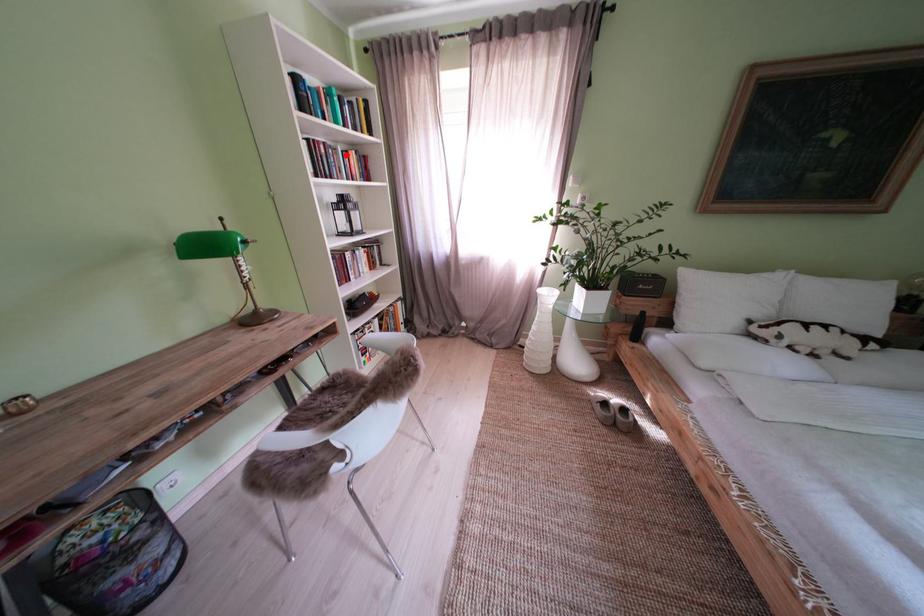
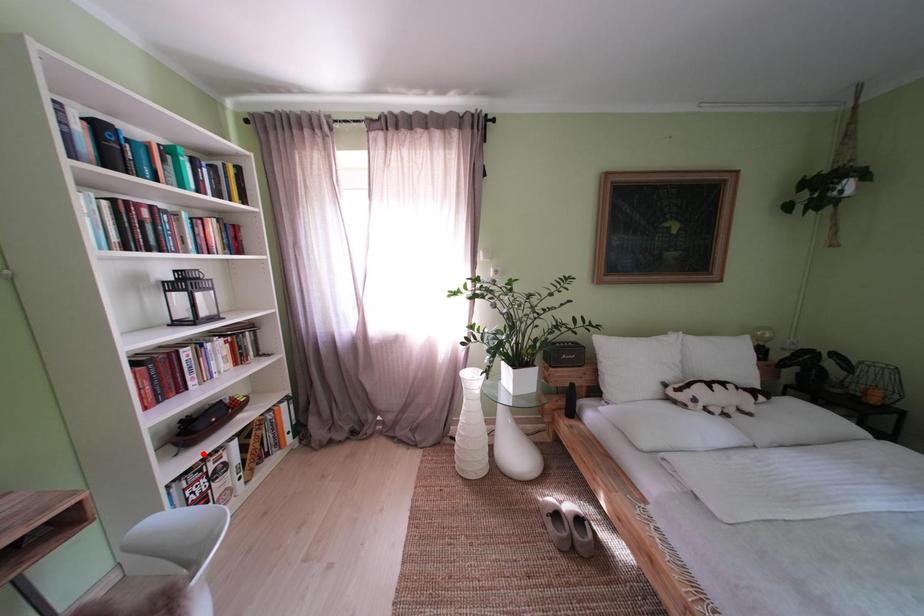
I am providing you with two images of the same scene from different viewpoints. A red point is marked on the first image and another point is marked on the second image. Are the points marked in image1 and image2 representing the same 3D position?

No